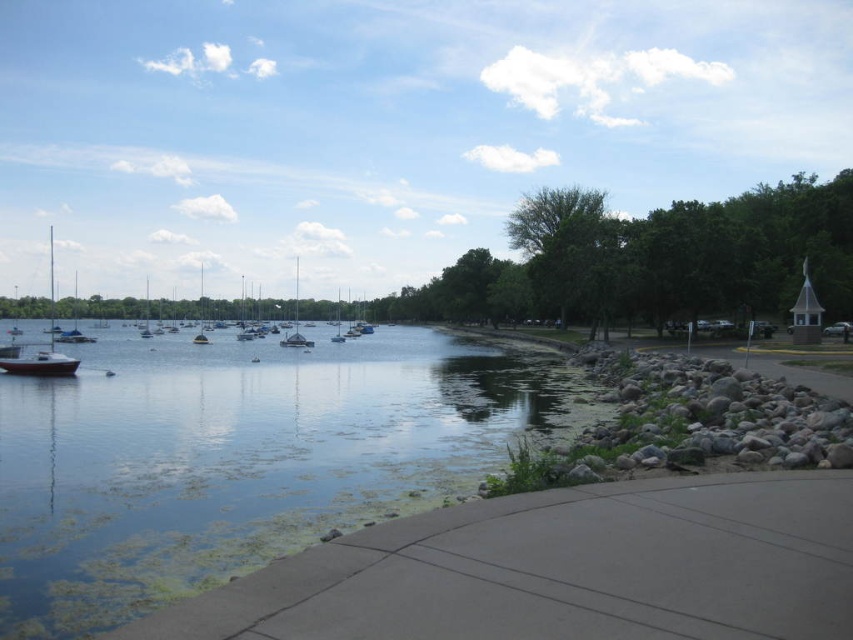
You are a photographer positioned on the walkway and want to capture both the matte white boat at left and the white glossy sailboat at center in a single shot. Which boat should you adjust your camera angle to include first?

The matte white boat at left is to the right of the white glossy sailboat at center, so you should adjust your camera angle to include the white glossy sailboat at center first, then pan to the right to include the matte white boat at left.